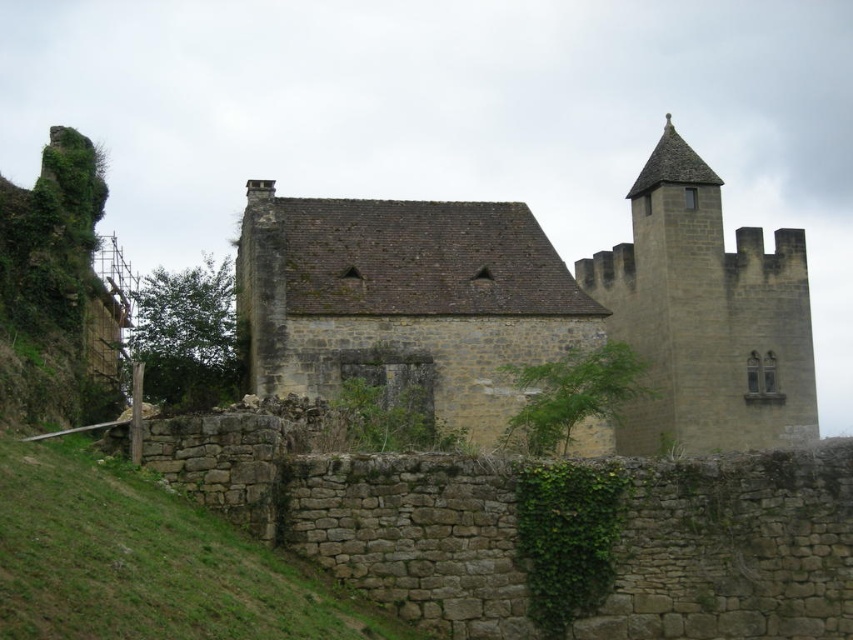
Question: Which is farther from the brown stone tower at upper right?

Choices:
 (A) green leafy ivy at center
 (B) brown stone castle at center

Answer: (A)

Question: Does brown stone tower at upper right appear over green leafy ivy at center?

Choices:
 (A) no
 (B) yes

Answer: (B)

Question: Which point is farther to the camera?

Choices:
 (A) brown stone castle at center
 (B) green leafy ivy at center

Answer: (A)

Question: Which point is closer to the camera?

Choices:
 (A) (498, 316)
 (B) (561, 420)
 (C) (664, 228)

Answer: (B)

Question: Can you confirm if brown stone tower at upper right is wider than green leafy ivy at center?

Choices:
 (A) yes
 (B) no

Answer: (A)

Question: Does brown stone tower at upper right have a smaller size compared to green leafy ivy at center?

Choices:
 (A) no
 (B) yes

Answer: (A)